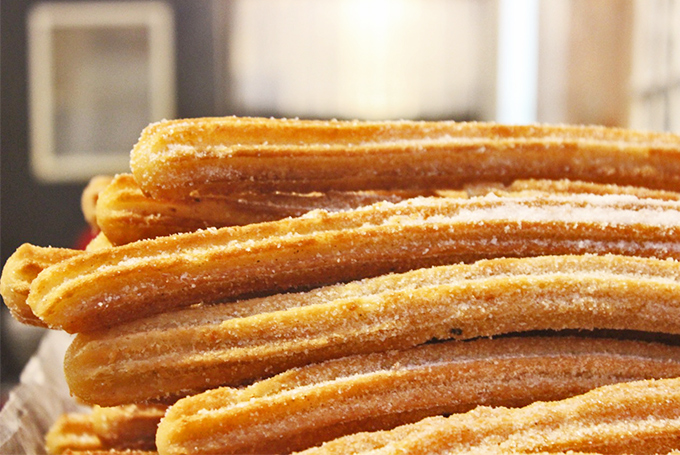
Locate an element on the screen. Image resolution: width=680 pixels, height=455 pixels. space to left of multi-pane window is located at coordinates (593, 88).